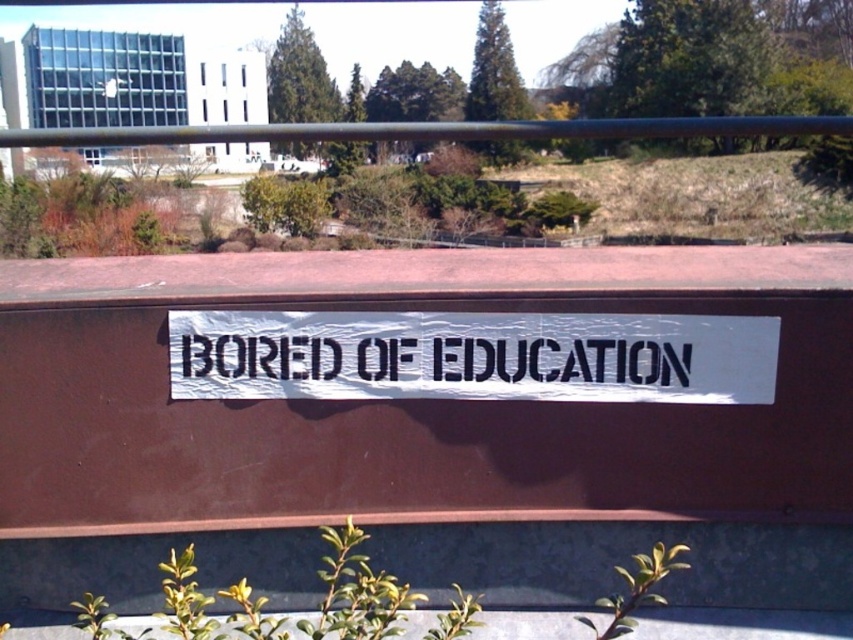
You are a painter standing in front of the black paper at center and the black metal rail at upper center. You want to hang a small painting that requires 10 cm of height. Can you determine which object has enough space vertically to accommodate the painting?

The black metal rail at upper center has a greater height than the black paper at center. Since the painting requires 10 cm of height, the black metal rail at upper center likely has sufficient vertical space, while the black paper at center may not due to its smaller height.

You are a pedestrian walking past the black metal rail at upper center and the black paper at center. Which object is closer to the ground?

The black paper at center is closer to the ground because it is located below the black metal rail at upper center.

You are a painter who wants to paint the white paper sign at center and the black metal rail at upper center. You have a limited amount of paint. Which object requires more paint to cover its entire surface?

The black metal rail at upper center requires more paint because it has a greater width than the white paper sign at center.